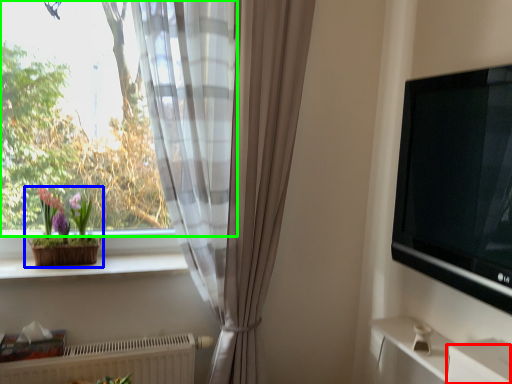
Question: Estimate the real-world distances between objects in this image. Which object is closer to drawer (highlighted by a red box), houseplant (highlighted by a blue box) or window (highlighted by a green box)?

Choices:
 (A) houseplant
 (B) window

Answer: (A)